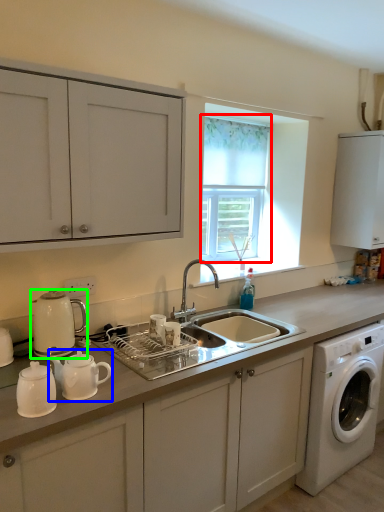
Question: Which object is positioned farthest from window screen (highlighted by a red box)? Select from tea pot (highlighted by a blue box) and coffeepot (highlighted by a green box).

Choices:
 (A) tea pot
 (B) coffeepot

Answer: (A)